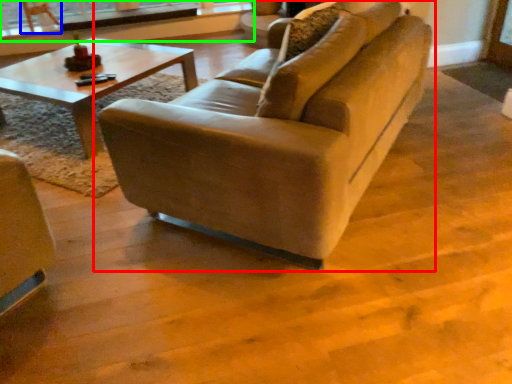
Question: Which object is positioned closest to studio couch (highlighted by a red box)? Select from armchair (highlighted by a blue box) and window frame (highlighted by a green box).

Choices:
 (A) armchair
 (B) window frame

Answer: (B)